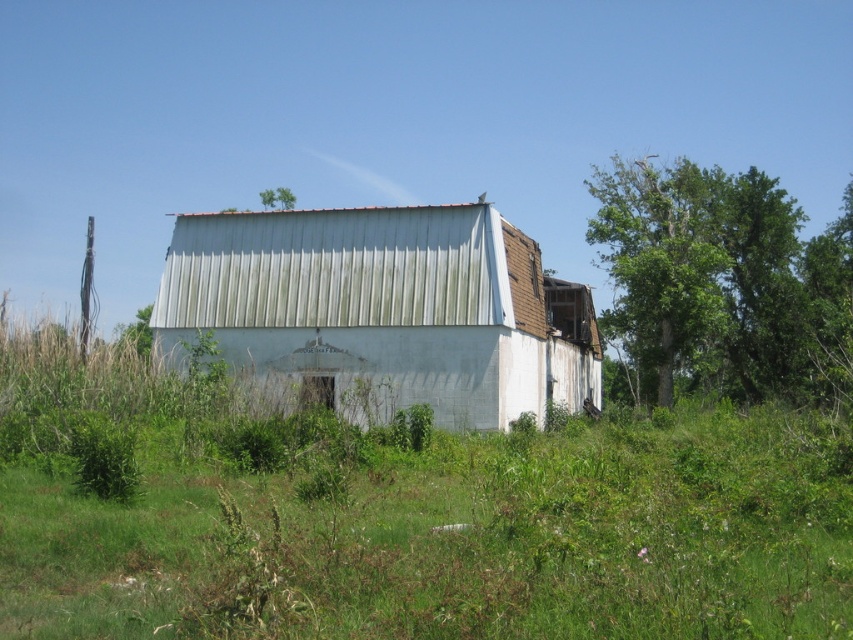
Does white corrugated metal barn at center come behind green leafy tree at upper center?

No, it is in front of green leafy tree at upper center.

Which is behind, point (550, 282) or point (264, 202)?

The point (264, 202) is more distant.

Find the location of a particular element. This screenshot has height=640, width=853. white corrugated metal barn at center is located at coordinates (384, 308).

Image resolution: width=853 pixels, height=640 pixels. What are the coordinates of `white corrugated metal barn at center` in the screenshot? It's located at (384, 308).

Is green leafy tree at right behind green leafy tree at upper center?

No, green leafy tree at right is in front of green leafy tree at upper center.

Does green leafy tree at right appear under green leafy tree at upper center?

Indeed, green leafy tree at right is positioned under green leafy tree at upper center.

What do you see at coordinates (723, 280) in the screenshot? The image size is (853, 640). I see `green leafy tree at right` at bounding box center [723, 280].

Find the location of a particular element. green leafy tree at right is located at coordinates (723, 280).

Is white corrugated metal barn at center behind green leafy tree at right?

No, it is in front of green leafy tree at right.

Does white corrugated metal barn at center have a lesser width compared to green leafy tree at right?

Indeed, white corrugated metal barn at center has a lesser width compared to green leafy tree at right.

Who is more distant from viewer, (x=163, y=289) or (x=732, y=339)?

The point (x=732, y=339) is more distant.

Locate an element on the screen. The height and width of the screenshot is (640, 853). white corrugated metal barn at center is located at coordinates (384, 308).